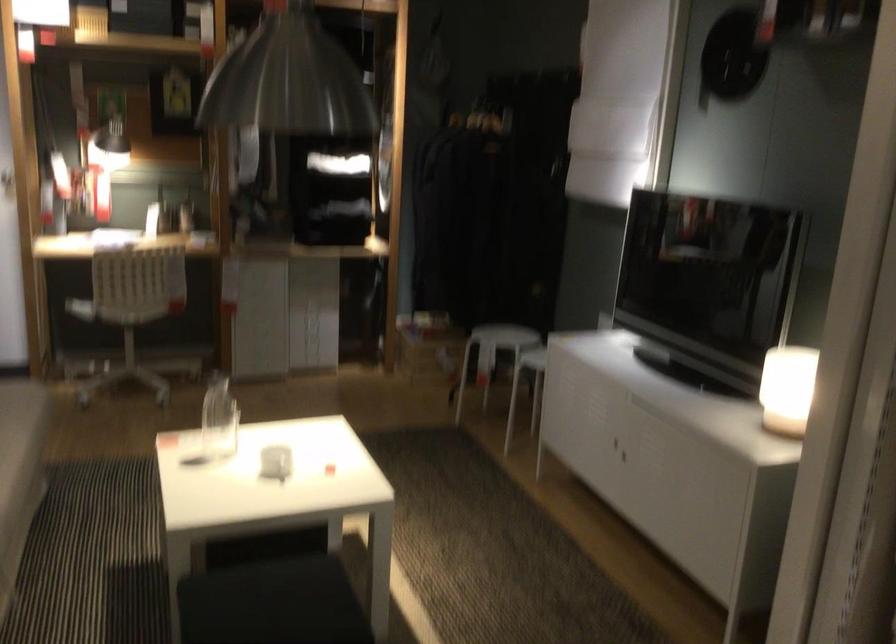
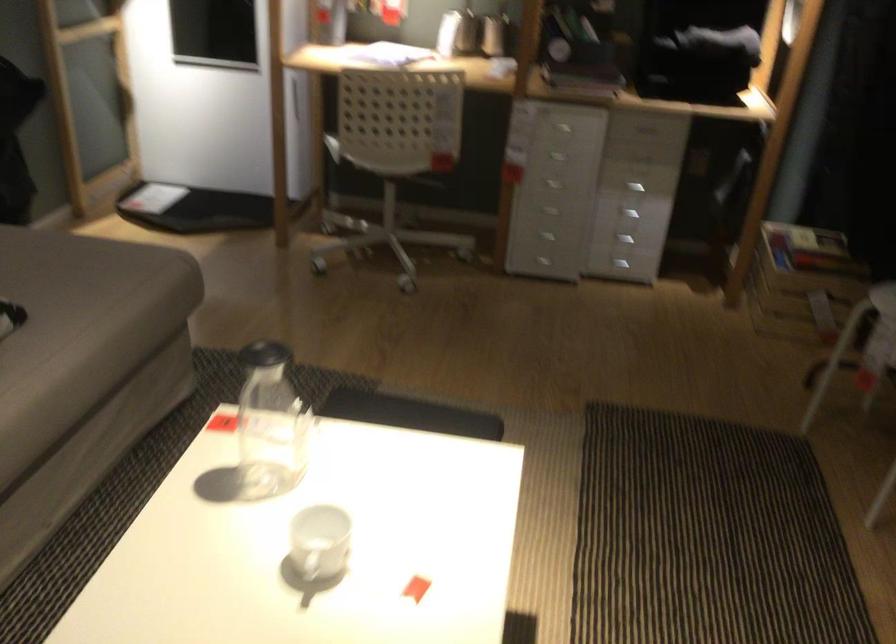
In the second image, find the point that corresponds to (309,343) in the first image.

(625, 240)